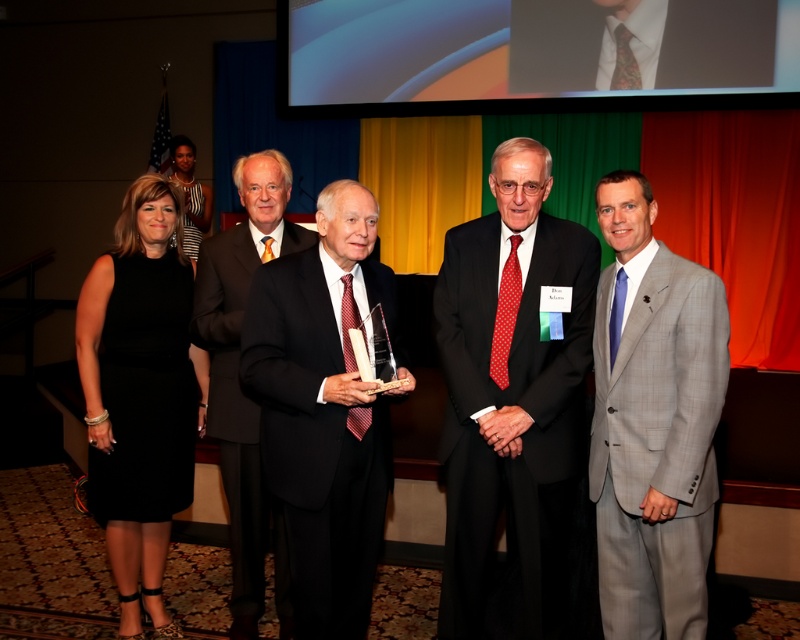
Question: Can you confirm if gray checkered suit at right is wider than matte black suit at center?

Choices:
 (A) no
 (B) yes

Answer: (A)

Question: Which object appears farthest from the camera in this image?

Choices:
 (A) matte black suit at center
 (B) black dress at left
 (C) gray checkered suit at right
 (D) dark suit at center

Answer: (B)

Question: Which object is farther from the camera taking this photo?

Choices:
 (A) matte black suit at center
 (B) black dress at left

Answer: (B)

Question: Based on their relative distances, which object is farther from the matte black suit at center?

Choices:
 (A) gray checkered suit at right
 (B) black dress at left
 (C) dark suit at center
 (D) polished black suit at center

Answer: (A)

Question: Does gray checkered suit at right appear under matte black suit at center?

Choices:
 (A) no
 (B) yes

Answer: (B)

Question: Does polished black suit at center appear over gray checkered suit at right?

Choices:
 (A) yes
 (B) no

Answer: (B)